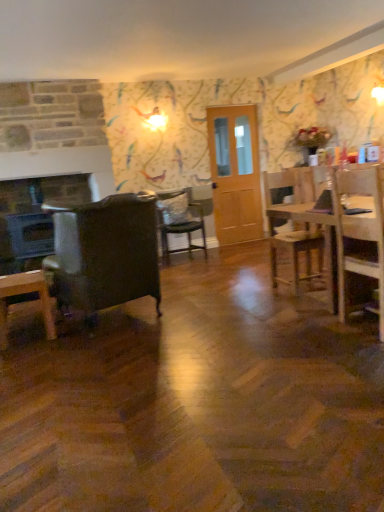
Question: Is wooden table at right behind wooden desk at lower left?

Choices:
 (A) no
 (B) yes

Answer: (A)

Question: Does wooden table at right have a lesser width compared to wooden desk at lower left?

Choices:
 (A) no
 (B) yes

Answer: (A)

Question: Is the position of wooden table at right less distant than that of wooden desk at lower left?

Choices:
 (A) yes
 (B) no

Answer: (A)

Question: From a real-world perspective, is wooden table at right positioned over wooden desk at lower left based on gravity?

Choices:
 (A) no
 (B) yes

Answer: (B)

Question: Considering the relative sizes of wooden table at right and wooden desk at lower left in the image provided, is wooden table at right wider than wooden desk at lower left?

Choices:
 (A) yes
 (B) no

Answer: (A)

Question: In the image, is wooden desk at lower left positioned in front of or behind matte black fireplace at left?

Choices:
 (A) behind
 (B) front

Answer: (B)

Question: Considering the relative positions of wooden desk at lower left and matte black fireplace at left in the image provided, is wooden desk at lower left to the left or to the right of matte black fireplace at left?

Choices:
 (A) right
 (B) left

Answer: (A)

Question: Considering the positions of wooden desk at lower left and matte black fireplace at left in the image, is wooden desk at lower left bigger or smaller than matte black fireplace at left?

Choices:
 (A) small
 (B) big

Answer: (A)

Question: From a real-world perspective, is wooden desk at lower left positioned above or below matte black fireplace at left?

Choices:
 (A) above
 (B) below

Answer: (B)

Question: Considering the positions of wooden chair at right, positioned as the second chair in front-to-back order, and wooden table at right in the image, is wooden chair at right, positioned as the second chair in front-to-back order, wider or thinner than wooden table at right?

Choices:
 (A) wide
 (B) thin

Answer: (B)

Question: Considering the relative positions of wooden chair at right, positioned as the second chair in front-to-back order, and wooden table at right in the image provided, is wooden chair at right, positioned as the second chair in front-to-back order, to the left or to the right of wooden table at right?

Choices:
 (A) left
 (B) right

Answer: (A)

Question: In the image, is wooden chair at right, the second chair viewed from the back, positioned in front of or behind wooden table at right?

Choices:
 (A) behind
 (B) front

Answer: (A)

Question: From the image's perspective, relative to wooden table at right, is wooden chair at right, positioned as the 3th chair in left-to-right order, above or below?

Choices:
 (A) above
 (B) below

Answer: (A)

Question: In terms of height, does light brown wooden door at center look taller or shorter compared to white soft pillow at center?

Choices:
 (A) short
 (B) tall

Answer: (B)

Question: Based on their sizes in the image, would you say light brown wooden door at center is bigger or smaller than white soft pillow at center?

Choices:
 (A) big
 (B) small

Answer: (A)